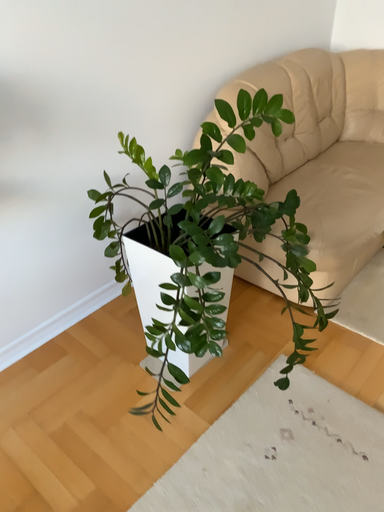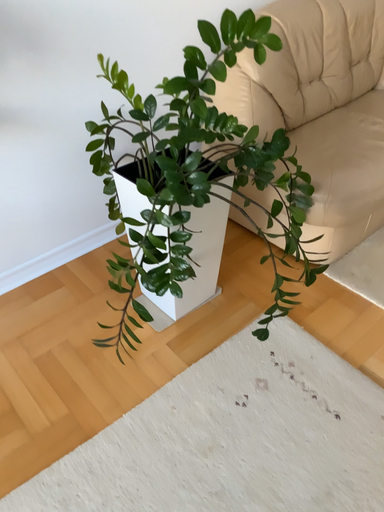
Question: Which way did the camera rotate in the video?

Choices:
 (A) rotated downward
 (B) rotated upward

Answer: (A)